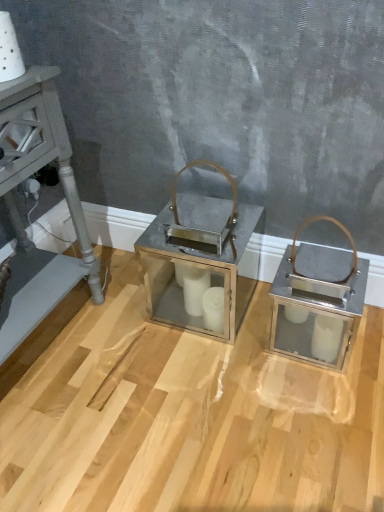
Question: Is metallic silver lantern at center bigger or smaller than metallic gray side table at left?

Choices:
 (A) big
 (B) small

Answer: (B)

Question: Relative to metallic gray side table at left, is metallic silver lantern at center in front or behind?

Choices:
 (A) front
 (B) behind

Answer: (B)

Question: Would you say metallic silver lantern at center is inside or outside metallic gray side table at left?

Choices:
 (A) outside
 (B) inside

Answer: (A)

Question: Is metallic gray side table at left in front of or behind metallic silver lantern at center in the image?

Choices:
 (A) front
 (B) behind

Answer: (A)

Question: In terms of size, does metallic gray side table at left appear bigger or smaller than metallic silver lantern at center?

Choices:
 (A) big
 (B) small

Answer: (A)

Question: From a real-world perspective, is metallic gray side table at left positioned above or below metallic silver lantern at center?

Choices:
 (A) below
 (B) above

Answer: (B)

Question: From the image's perspective, is metallic gray side table at left located above or below metallic silver lantern at center?

Choices:
 (A) above
 (B) below

Answer: (B)